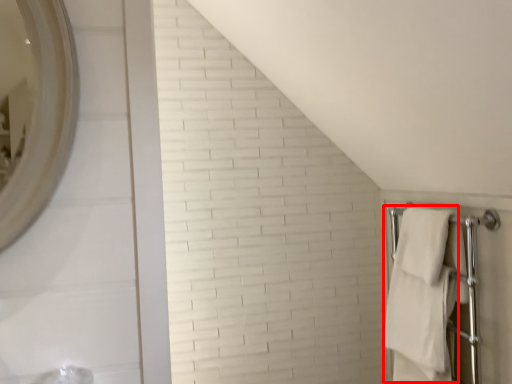
Question: From the image's perspective, where is bath towel (annotated by the red box) located relative to bath towel?

Choices:
 (A) above
 (B) below

Answer: (B)